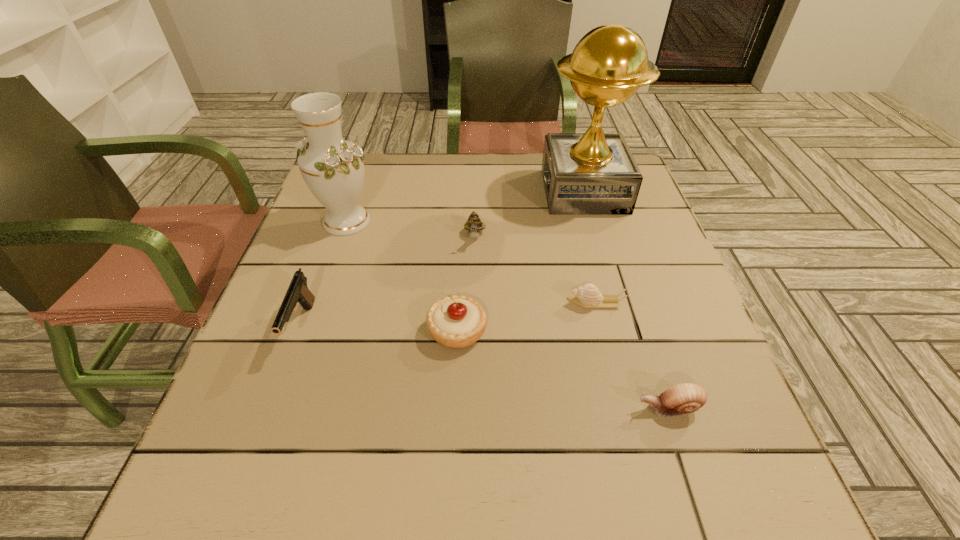
Locate an element on the screen. The height and width of the screenshot is (540, 960). free space at the left edge of the desktop is located at coordinates (324, 284).

In the image, there is a desktop. Identify the location of free space at the right edge. The width and height of the screenshot is (960, 540). (617, 265).

Find the location of `vacant region at the near left corner of the desktop`. vacant region at the near left corner of the desktop is located at coordinates (202, 504).

This screenshot has width=960, height=540. In order to click on vacant region at the near right corner of the desktop in this screenshot , I will do `click(760, 481)`.

Identify the location of vacant region between the tallest object and the tallest escargot. The width and height of the screenshot is (960, 540). (529, 214).

The height and width of the screenshot is (540, 960). In order to click on vacant point located between the pistol and the vase in this screenshot , I will do `click(324, 274)`.

Find the location of a particular element. This screenshot has height=540, width=960. free space between the pastry and the award is located at coordinates (520, 261).

Locate an element on the screen. The height and width of the screenshot is (540, 960). free spot between the sixth tallest object and the vase is located at coordinates (508, 315).

Locate an element on the screen. Image resolution: width=960 pixels, height=540 pixels. free space between the nearest escargot and the pistol is located at coordinates (485, 368).

Where is `unoccupied area between the nearest object and the shortest escargot`? unoccupied area between the nearest object and the shortest escargot is located at coordinates (632, 356).